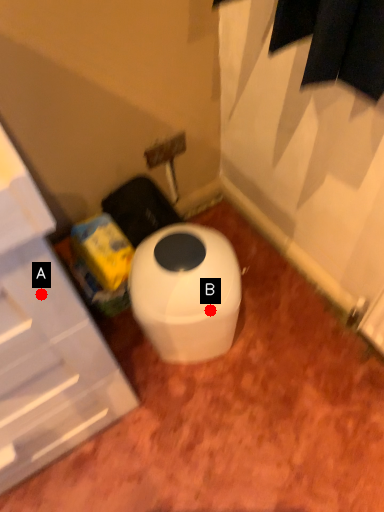
Question: Two points are circled on the image, labeled by A and B beside each circle. Which point is further to the camera?

Choices:
 (A) A is further
 (B) B is further

Answer: (B)